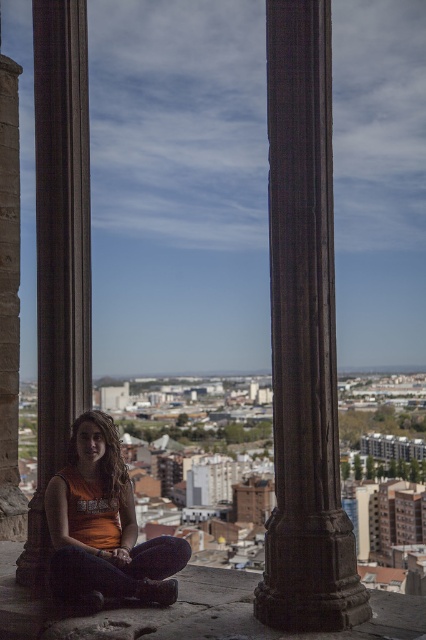
Question: Which of these objects is positioned closest to the orange fabric at center?

Choices:
 (A) brown stone pillar at left
 (B) dark stone column at center

Answer: (B)

Question: Is dark stone column at center smaller than brown stone pillar at left?

Choices:
 (A) no
 (B) yes

Answer: (B)

Question: Can you confirm if orange fabric at center is positioned above brown stone pillar at left?

Choices:
 (A) yes
 (B) no

Answer: (B)

Question: Considering the real-world distances, which object is closest to the orange fabric at center?

Choices:
 (A) dark stone column at center
 (B) brown stone pillar at left

Answer: (A)

Question: Does dark stone column at center come behind brown stone pillar at left?

Choices:
 (A) no
 (B) yes

Answer: (A)

Question: Which point is farther to the camera?

Choices:
 (A) (296, 420)
 (B) (160, 563)

Answer: (B)